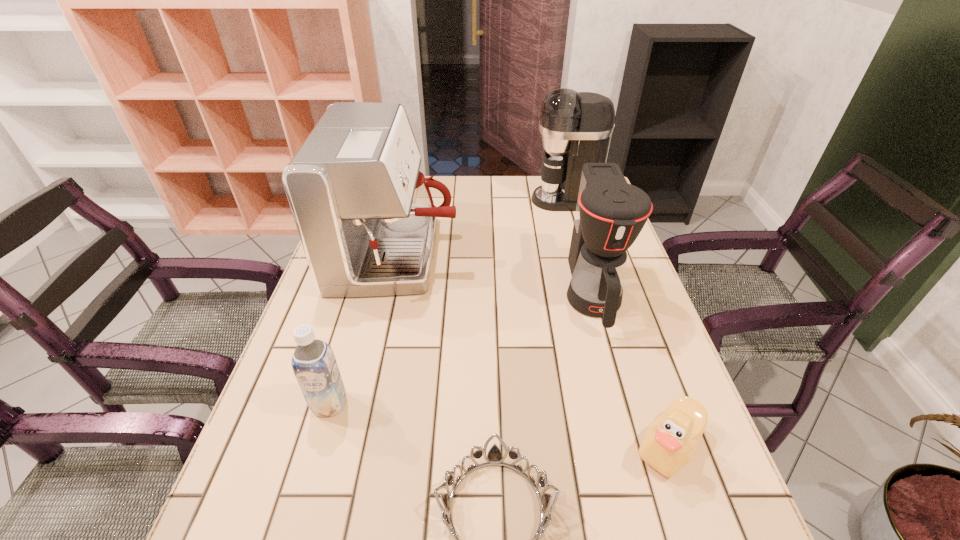
Find the location of a particular element. This screenshot has height=540, width=960. free space at the left edge of the desktop is located at coordinates (228, 497).

This screenshot has width=960, height=540. In the image, there is a desktop. What are the coordinates of `free space at the right edge` in the screenshot? It's located at (669, 353).

Find the location of a particular element. The image size is (960, 540). vacant area that lies between the fourth shortest object and the second shortest object is located at coordinates (631, 370).

Find the location of a particular element. empty location between the farthest object and the second shortest object is located at coordinates (617, 323).

The height and width of the screenshot is (540, 960). What are the coordinates of `vacant space in between the leftmost coffee maker and the fourth tallest object` in the screenshot? It's located at (364, 329).

At what (x,y) coordinates should I click in order to perform the action: click on empty location between the fifth tallest object and the farthest object. Please return your answer as a coordinate pair (x, y). The width and height of the screenshot is (960, 540). Looking at the image, I should click on (617, 323).

The height and width of the screenshot is (540, 960). I want to click on free space between the farthest object and the third shortest object, so click(447, 302).

Point out which object is positioned as the second nearest to the fifth tallest object. Please provide its 2D coordinates. Your answer should be formatted as a tuple, i.e. [(x, y)], where the tuple contains the x and y coordinates of a point satisfying the conditions above.

[(610, 213)]

Identify which object is located as the fourth nearest to the leftmost coffee maker. Please provide its 2D coordinates. Your answer should be formatted as a tuple, i.e. [(x, y)], where the tuple contains the x and y coordinates of a point satisfying the conditions above.

[(494, 457)]

Where is `coffee maker that is the second nearest to the farthest coffee maker`? This screenshot has width=960, height=540. coffee maker that is the second nearest to the farthest coffee maker is located at coordinates (610, 213).